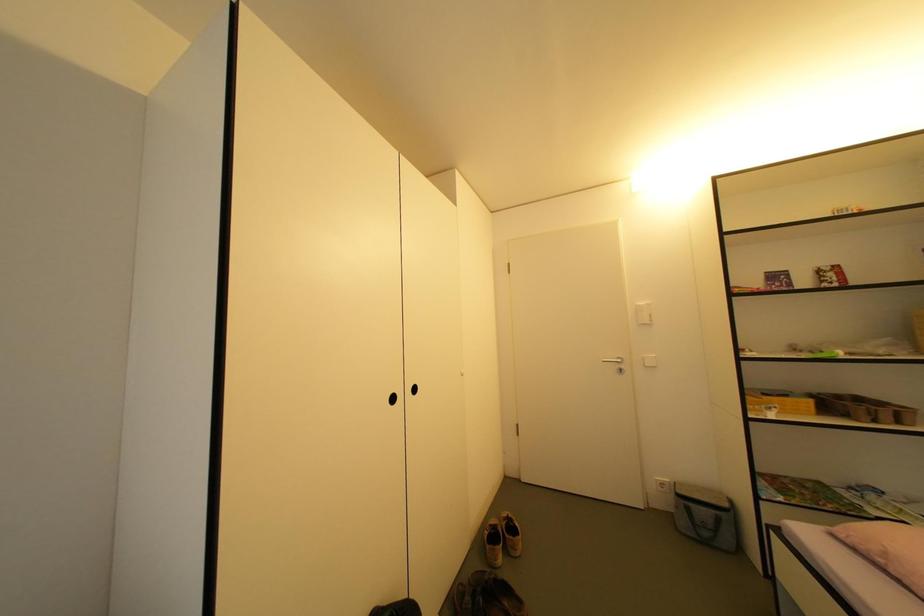
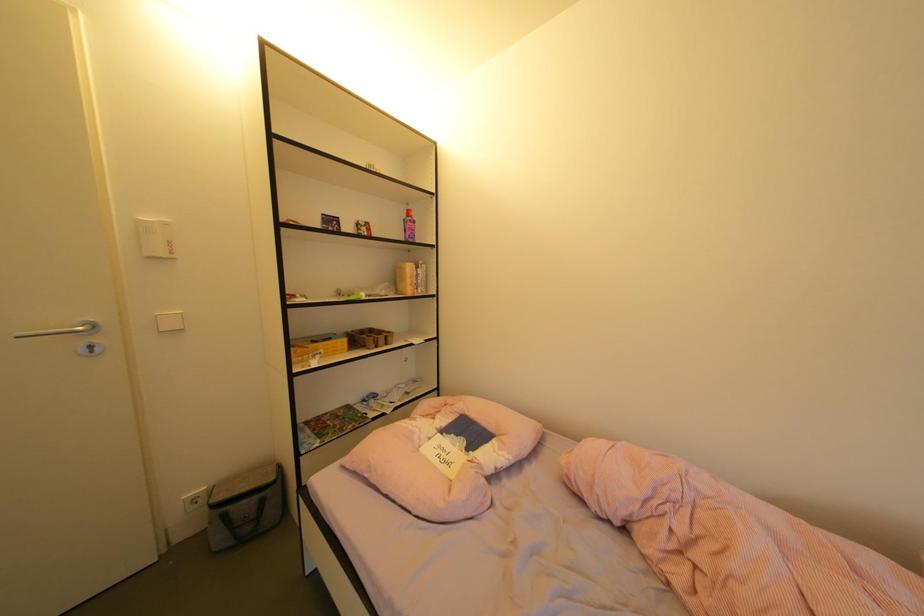
Question: The camera is either moving clockwise (left) or counter-clockwise (right) around the object. The first image is from the beginning of the video and the second image is from the end. Is the camera moving left or right when shooting the video?

Choices:
 (A) Left
 (B) Right

Answer: (A)